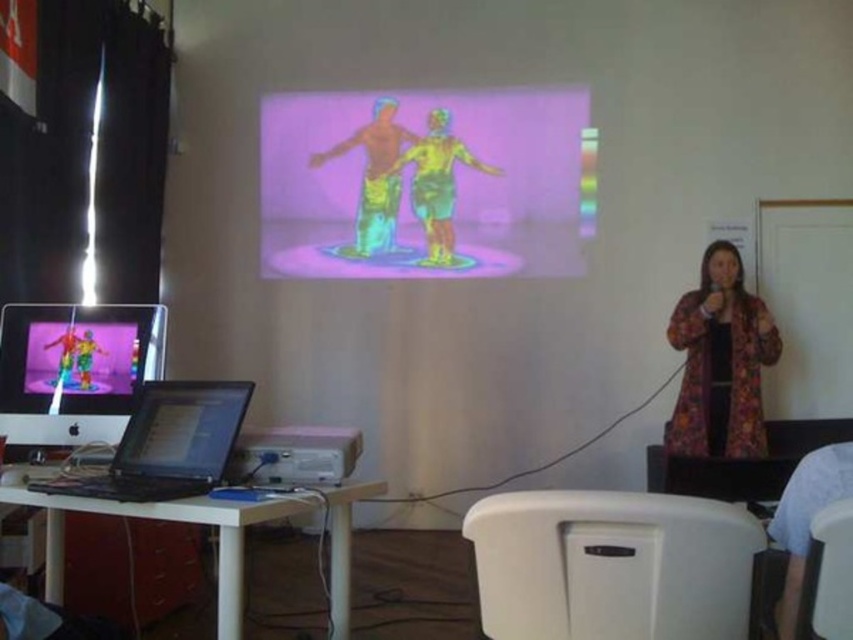
Which is more to the right, pink plastic projector at center or white plastic chair at lower right?

From the viewer's perspective, white plastic chair at lower right appears more on the right side.

Who is lower down, pink plastic projector at center or white plastic chair at lower right?

white plastic chair at lower right is lower down.

Is point (257, 438) farther from camera compared to point (827, 600)?

Yes, point (257, 438) is behind point (827, 600).

Image resolution: width=853 pixels, height=640 pixels. I want to click on pink plastic projector at center, so click(x=294, y=454).

Can you confirm if white plastic chair at lower center is positioned to the left of matte plastic toy at left?

Incorrect, white plastic chair at lower center is not on the left side of matte plastic toy at left.

What do you see at coordinates (611, 564) in the screenshot?
I see `white plastic chair at lower center` at bounding box center [611, 564].

Where is `white plastic chair at lower center`? This screenshot has height=640, width=853. white plastic chair at lower center is located at coordinates (611, 564).

Is translucent plastic screen at center above matte black monitor at left?

Correct, translucent plastic screen at center is located above matte black monitor at left.

Is point (439, 170) farther from camera compared to point (0, 339)?

That is True.

Who is more distant from viewer, [418,253] or [44,358]?

The point [418,253] is behind.

Where is `translucent plastic screen at center`? translucent plastic screen at center is located at coordinates (422, 182).